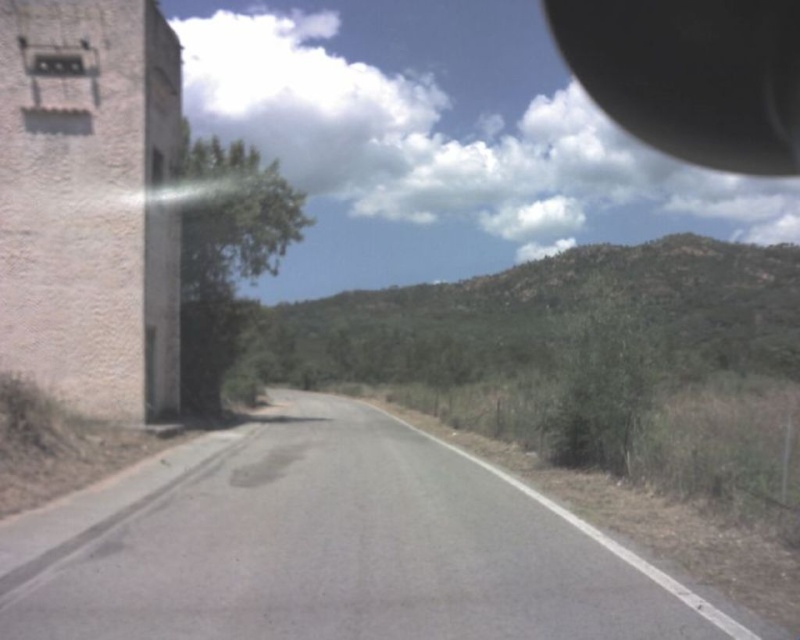
Question: Which of the following is the closest to the observer?

Choices:
 (A) black rubber view mirror at upper right
 (B) gray asphalt road at center

Answer: (B)

Question: Which point is farther to the camera?

Choices:
 (A) gray asphalt road at center
 (B) black rubber view mirror at upper right

Answer: (B)

Question: Does gray asphalt road at center appear over black rubber view mirror at upper right?

Choices:
 (A) yes
 (B) no

Answer: (B)

Question: From the image, what is the correct spatial relationship of gray asphalt road at center in relation to black rubber view mirror at upper right?

Choices:
 (A) right
 (B) left

Answer: (B)

Question: Which point is closer to the camera taking this photo?

Choices:
 (A) click(x=644, y=100)
 (B) click(x=316, y=605)

Answer: (B)

Question: Can you confirm if gray asphalt road at center is bigger than black rubber view mirror at upper right?

Choices:
 (A) yes
 (B) no

Answer: (B)